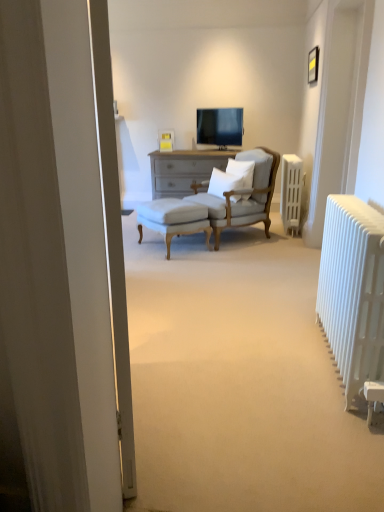
Question: Can you confirm if white upholstered stool at center is thinner than white metallic radiator at right, placed as the 1th radiator when sorted from left to right?

Choices:
 (A) yes
 (B) no

Answer: (B)

Question: Is white upholstered stool at center smaller than white metallic radiator at right, the 1th radiator viewed from the front?

Choices:
 (A) yes
 (B) no

Answer: (A)

Question: Is white upholstered stool at center not within white metallic radiator at right, which is counted as the second radiator, starting from the right?

Choices:
 (A) no
 (B) yes

Answer: (B)

Question: From the image's perspective, is white upholstered stool at center under white metallic radiator at right, the 1th radiator viewed from the front?

Choices:
 (A) no
 (B) yes

Answer: (A)

Question: Is white upholstered stool at center beside white metallic radiator at right, placed as the 1th radiator when sorted from left to right?

Choices:
 (A) yes
 (B) no

Answer: (B)

Question: From a real-world perspective, relative to white upholstered stool at center, is white plastic radiator at right, arranged as the second radiator when ordered from the bottom, vertically above or below?

Choices:
 (A) below
 (B) above

Answer: (B)

Question: Is point (284, 183) closer or farther from the camera than point (170, 231)?

Choices:
 (A) farther
 (B) closer

Answer: (A)

Question: Is white plastic radiator at right, arranged as the second radiator when ordered from the bottom, inside the boundaries of white upholstered stool at center, or outside?

Choices:
 (A) inside
 (B) outside

Answer: (B)

Question: From the image's perspective, relative to white upholstered stool at center, is white plastic radiator at right, the first radiator positioned from the back, above or below?

Choices:
 (A) above
 (B) below

Answer: (A)

Question: From the image's perspective, is matte black tv at center located above or below white plastic radiator at right, the second radiator when ordered from left to right?

Choices:
 (A) below
 (B) above

Answer: (B)

Question: Choose the correct answer: Is matte black tv at center inside white plastic radiator at right, positioned as the first radiator in top-to-bottom order, or outside it?

Choices:
 (A) outside
 (B) inside

Answer: (A)

Question: Based on their sizes in the image, would you say matte black tv at center is bigger or smaller than white plastic radiator at right, positioned as the first radiator in top-to-bottom order?

Choices:
 (A) big
 (B) small

Answer: (B)

Question: Is point (200, 117) positioned closer to the camera than point (299, 183)?

Choices:
 (A) closer
 (B) farther

Answer: (B)

Question: In terms of size, does white soft pillow at center, the second pillow viewed from the left, appear bigger or smaller than matte black tv at center?

Choices:
 (A) big
 (B) small

Answer: (B)

Question: In the image, is white soft pillow at center, the second pillow viewed from the left, on the left side or the right side of matte black tv at center?

Choices:
 (A) right
 (B) left

Answer: (A)